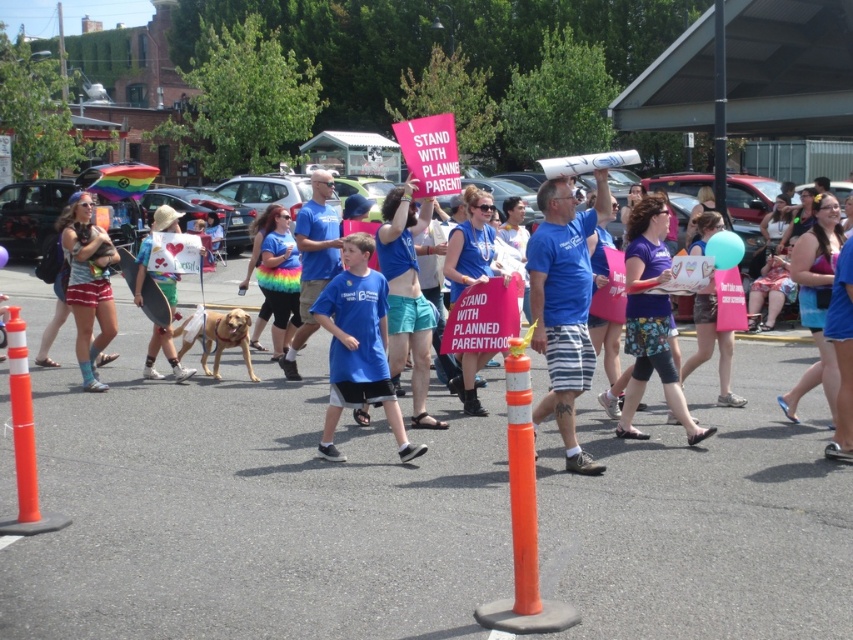
Which is behind, point (143, 289) or point (172, 336)?

The point (143, 289) is behind.

The image size is (853, 640). Identify the location of camouflage shorts at center. [x=151, y=246].

Where is `camouflage shorts at center`? camouflage shorts at center is located at coordinates (151, 246).

Is blue cotton shirt at center in front of orange plastic traffic cone at lower left?

That is False.

Does blue cotton shirt at center have a lesser height compared to orange plastic traffic cone at lower left?

No.

You are a GUI agent. You are given a task and a screenshot of the screen. Output one action in this format:
    pyautogui.click(x=<x>, y=<y>)
    Task: Click on the blue cotton shirt at center
    
    Given the screenshot: What is the action you would take?
    pyautogui.click(x=358, y=346)

Where is `blue cotton shirt at center`? This screenshot has height=640, width=853. blue cotton shirt at center is located at coordinates (358, 346).

Can you confirm if blue cotton shirt at center is positioned above orange plastic traffic cone at center?

Yes, blue cotton shirt at center is above orange plastic traffic cone at center.

Who is positioned more to the left, blue cotton shirt at center or orange plastic traffic cone at center?

blue cotton shirt at center is more to the left.

Is point (387, 381) farther from viewer compared to point (525, 419)?

Yes.

The width and height of the screenshot is (853, 640). Find the location of `blue cotton shirt at center`. blue cotton shirt at center is located at coordinates (358, 346).